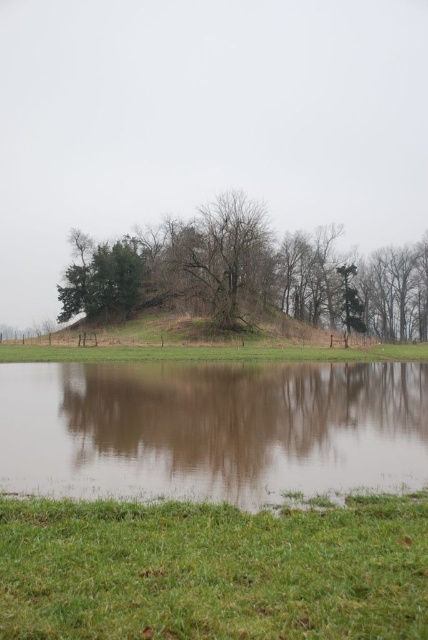
You are standing in the field and want to take a photo of both the brown reflective water at lower center and the green matte tree at upper left. Which object should you adjust your camera angle to include first if you want to capture both in the same frame?

Since the brown reflective water at lower center is not as tall as the green matte tree at upper left, you should first adjust your camera angle to include the green matte tree at upper left, which is taller, to ensure both fit in the frame.

You are standing at the edge of the green grassy field at center and want to walk towards the green grassy at lower center. Based on their widths, which area would you find narrower as you approach?

The green grassy at lower center is narrower than the green grassy field at center, so you would find the green grassy at lower center narrower as you approach.

You are standing on the grassy field and see the point marked as point (211, 429). Can you step onto this point without getting wet?

The point (211, 429) is on brown reflective water at lower center, so stepping onto this point would get you wet.